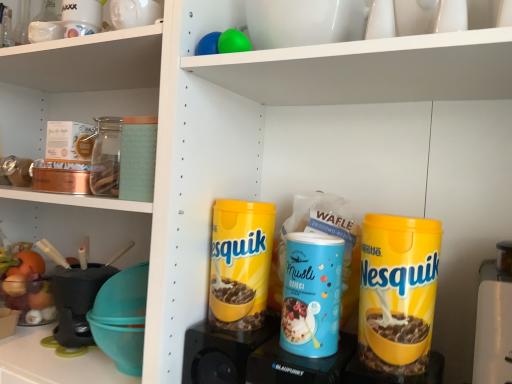
Question: Is yellow plastic speaker at lower center, the 2th appliance from the right, shorter than yellow matte nesquik canister at center right, which ranks as the 2th cereal in back-to-front order?

Choices:
 (A) no
 (B) yes

Answer: (B)

Question: Is yellow matte nesquik canister at center right, which ranks as the 2th cereal in back-to-front order, inside yellow plastic speaker at lower center, the first appliance positioned from the left?

Choices:
 (A) no
 (B) yes

Answer: (A)

Question: Is yellow plastic speaker at lower center, the first appliance positioned from the left, wider than yellow matte nesquik canister at center right, which ranks as the 2th cereal in back-to-front order?

Choices:
 (A) no
 (B) yes

Answer: (B)

Question: From a real-world perspective, does yellow plastic speaker at lower center, the first appliance positioned from the left, stand above yellow matte nesquik canister at center right, the second cereal positioned from the left?

Choices:
 (A) yes
 (B) no

Answer: (B)

Question: From a real-world perspective, is yellow plastic speaker at lower center, the 2th appliance from the right, below yellow matte nesquik canister at center right, which ranks as the 2th cereal in back-to-front order?

Choices:
 (A) no
 (B) yes

Answer: (B)

Question: Can you confirm if yellow plastic speaker at lower center, the 2th appliance from the right, is taller than yellow matte nesquik canister at center right, marked as the 1th cereal in a right-to-left arrangement?

Choices:
 (A) yes
 (B) no

Answer: (B)

Question: Is blue plastic container at center, which ranks as the 2th appliance in left-to-right order, bigger than yellow matte nesquik canister at center, marked as the 1th cereal in a left-to-right arrangement?

Choices:
 (A) no
 (B) yes

Answer: (B)

Question: Could you tell me if blue plastic container at center, which ranks as the 2th appliance in left-to-right order, is turned towards yellow matte nesquik canister at center, marked as the 1th cereal in a left-to-right arrangement?

Choices:
 (A) no
 (B) yes

Answer: (A)

Question: Can you confirm if blue plastic container at center, marked as the first appliance in a right-to-left arrangement, is positioned to the right of yellow matte nesquik canister at center, marked as the 2th cereal in a front-to-back arrangement?

Choices:
 (A) yes
 (B) no

Answer: (A)

Question: Considering the relative sizes of blue plastic container at center, which ranks as the 2th appliance in left-to-right order, and yellow matte nesquik canister at center, the second cereal from the right, in the image provided, is blue plastic container at center, which ranks as the 2th appliance in left-to-right order, taller than yellow matte nesquik canister at center, the second cereal from the right,?

Choices:
 (A) yes
 (B) no

Answer: (B)

Question: Is the position of blue plastic container at center, marked as the first appliance in a right-to-left arrangement, more distant than that of yellow matte nesquik canister at center, marked as the 2th cereal in a front-to-back arrangement?

Choices:
 (A) no
 (B) yes

Answer: (A)

Question: From the image's perspective, would you say blue plastic container at center, which ranks as the 2th appliance in left-to-right order, is positioned over yellow matte nesquik canister at center, marked as the 1th cereal in a left-to-right arrangement?

Choices:
 (A) no
 (B) yes

Answer: (A)

Question: Is yellow plastic speaker at lower center, the first appliance positioned from the left, turned away from blue matte musli at center?

Choices:
 (A) yes
 (B) no

Answer: (B)